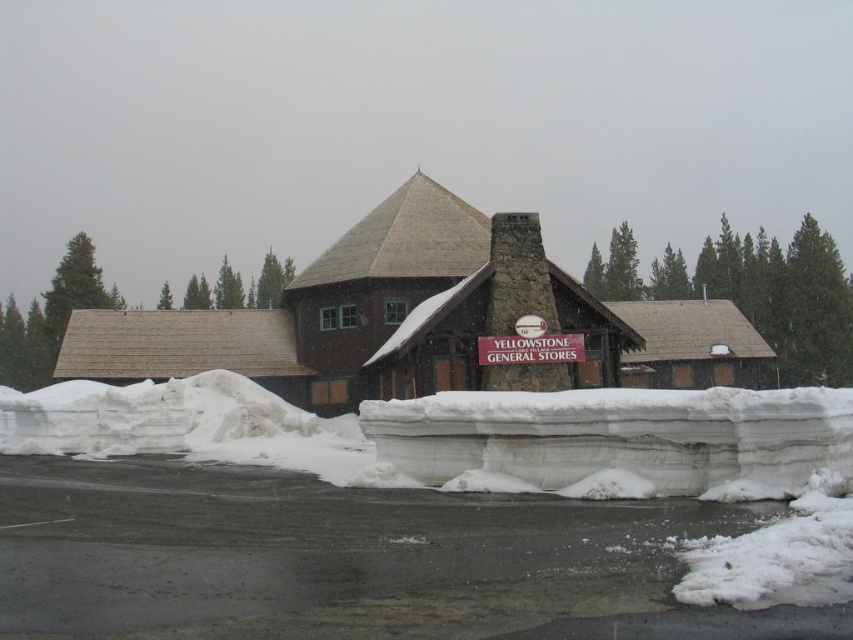
Is white snowdrift at lower center closer to camera compared to yellowstone general stores at center?

Yes, it is in front of yellowstone general stores at center.

This screenshot has height=640, width=853. What do you see at coordinates (618, 440) in the screenshot?
I see `white snowdrift at lower center` at bounding box center [618, 440].

At what (x,y) coordinates should I click in order to perform the action: click on white snowdrift at lower center. Please return your answer as a coordinate pair (x, y). Looking at the image, I should click on (618, 440).

The height and width of the screenshot is (640, 853). In order to click on white snowdrift at lower center in this screenshot , I will do `click(618, 440)`.